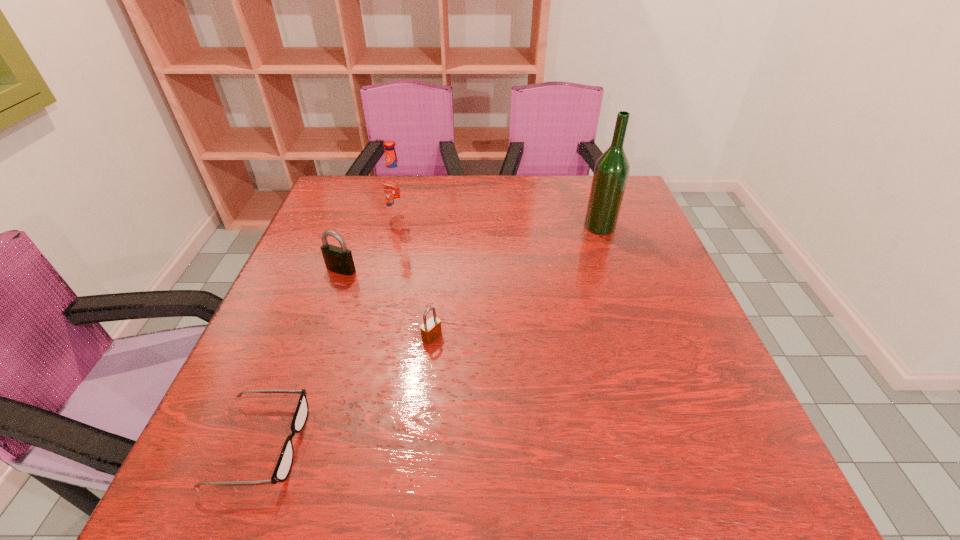
Identify the location of object located in the right edge section of the desktop. The height and width of the screenshot is (540, 960). (611, 172).

Image resolution: width=960 pixels, height=540 pixels. What are the coordinates of `object that is at the near left corner` in the screenshot? It's located at (284, 464).

Locate an element on the screen. Image resolution: width=960 pixels, height=540 pixels. object at the far right corner is located at coordinates (611, 172).

The image size is (960, 540). In the image, there is a desktop. Find the location of `vacant space at the far edge`. vacant space at the far edge is located at coordinates (384, 212).

I want to click on free space at the left edge of the desktop, so click(x=360, y=231).

Image resolution: width=960 pixels, height=540 pixels. In the image, there is a desktop. Identify the location of free region at the right edge. (654, 298).

Locate an element on the screen. vacant space at the near left corner of the desktop is located at coordinates (248, 497).

This screenshot has width=960, height=540. What are the coordinates of `vacant point at the near right corner` in the screenshot? It's located at (714, 490).

The image size is (960, 540). I want to click on empty space between the fourth farthest object and the tallest object, so click(x=516, y=281).

What are the coordinates of `vacant area between the alcohol and the taller padlock` in the screenshot? It's located at (470, 248).